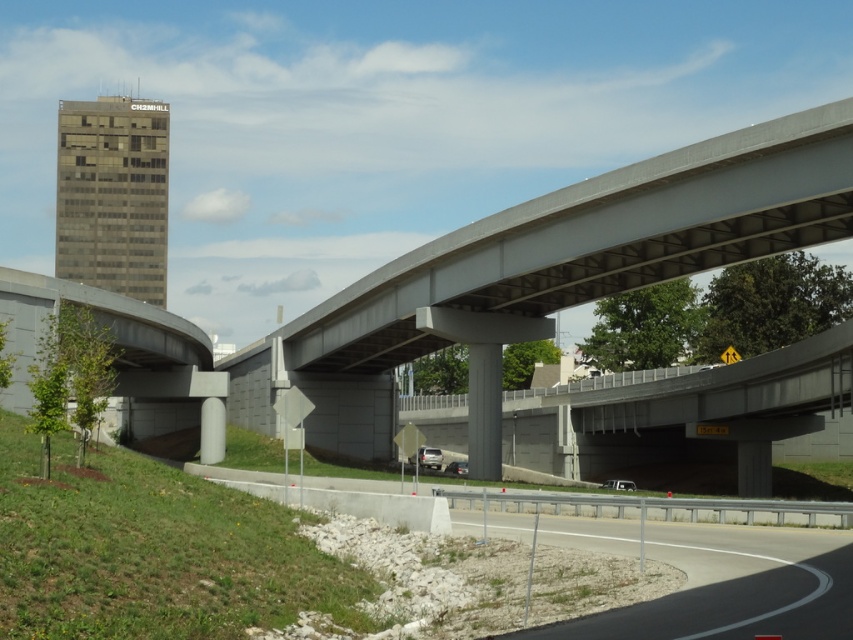
You are a construction inspector evaluating the highway interchange. You need to determine which object, the gray concrete bridge at center or the gray concrete pillar at center, requires more material for maintenance. Based on their sizes, which one would need more resources?

The gray concrete bridge at center has a larger size compared to gray concrete pillar at center, so it would require more material for maintenance.

You are driving a car and see the dark gray glass building at upper left and the satin silver sedan at center. Which object is positioned higher in the image?

The dark gray glass building at upper left is positioned higher than the satin silver sedan at center.

You are a drone operator trying to fly a drone over the dark gray glass building at upper left and the satin silver sedan at center. Considering their heights, which object will the drone need to ascend higher to pass over?

The drone will need to ascend higher to pass over the dark gray glass building at upper left because it has a greater height compared to the satin silver sedan at center.